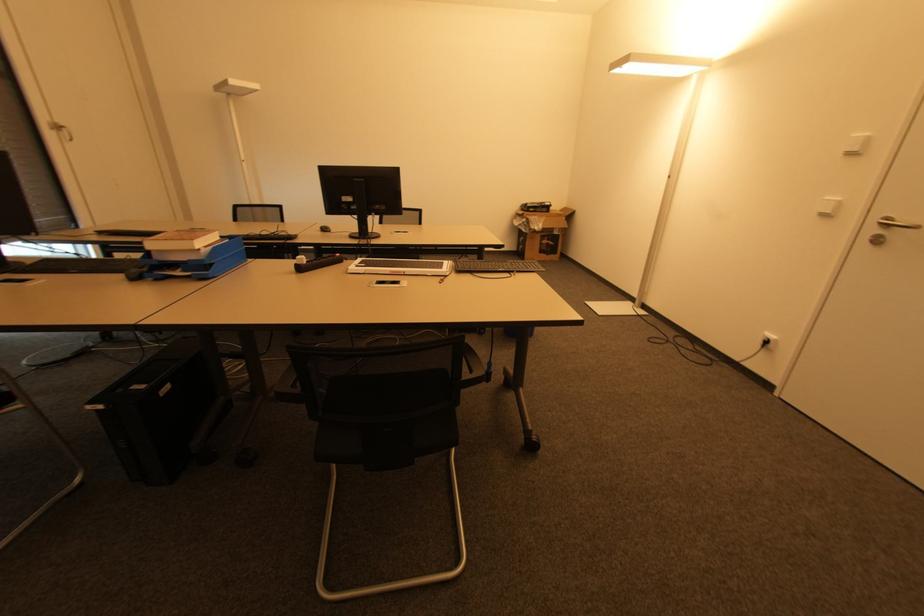
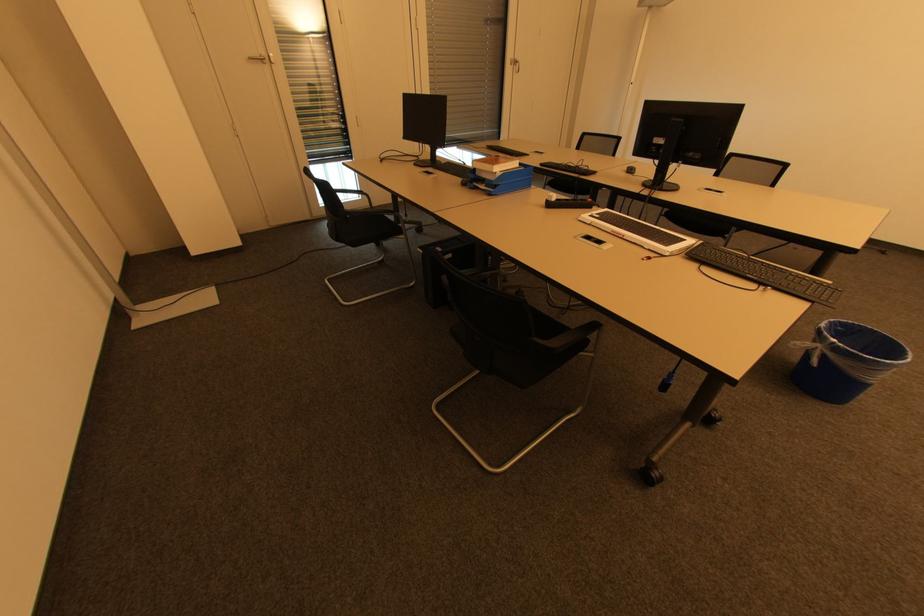
The point at (198, 248) is marked in the first image. Where is the corresponding point in the second image?

(495, 172)